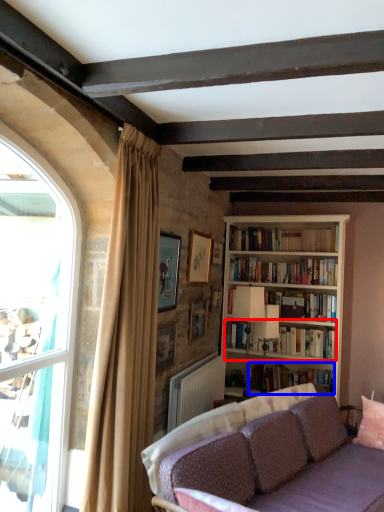
Question: Among these objects, which one is farthest to the camera, book (highlighted by a red box) or book (highlighted by a blue box)?

Choices:
 (A) book
 (B) book

Answer: (A)